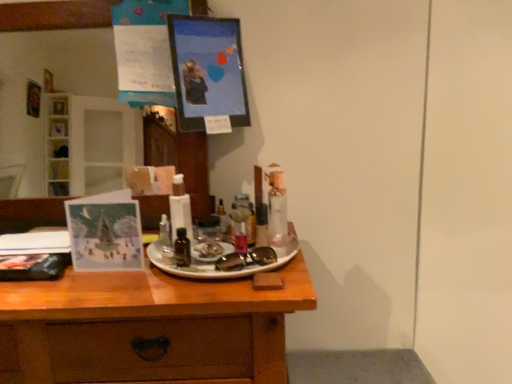
This screenshot has width=512, height=384. In order to click on free point to the right of black glass bottle at center, the first toiletry positioned from the left in this screenshot , I will do `click(242, 264)`.